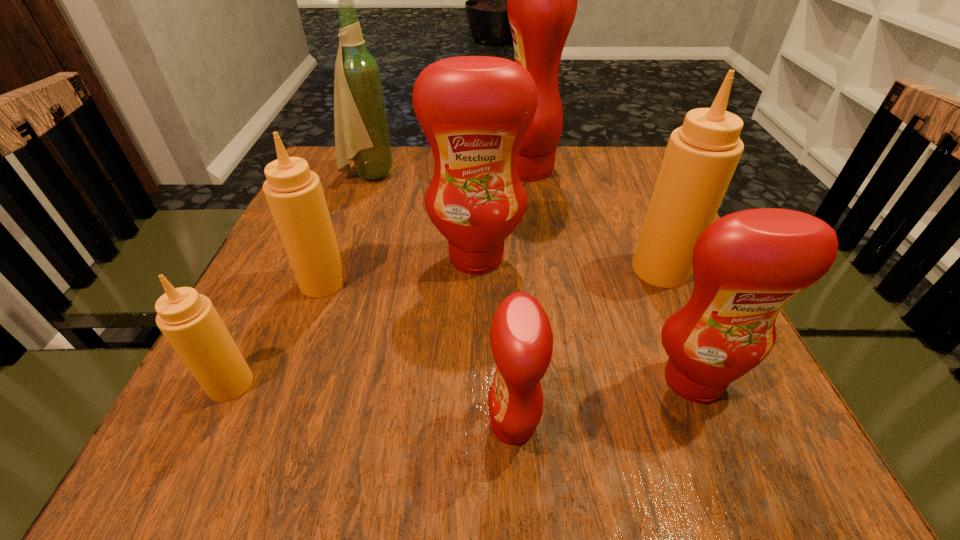
The height and width of the screenshot is (540, 960). What are the coordinates of `vacant space located 0.060m on the label side of the smallest red condiment` in the screenshot? It's located at click(x=445, y=424).

Image resolution: width=960 pixels, height=540 pixels. I want to click on vacant space located on the label side of the smallest red condiment, so click(x=389, y=424).

Locate an element on the screen. free space located on the right of the leftmost tan condiment is located at coordinates (x=514, y=384).

Identify the location of condiment that is at the far edge. This screenshot has width=960, height=540. (542, 0).

Find the location of a particular element. The width and height of the screenshot is (960, 540). wine bottle that is at the far edge is located at coordinates (362, 136).

This screenshot has width=960, height=540. What are the coordinates of `object present at the near edge` in the screenshot? It's located at (521, 338).

Find the location of a particular element. The width and height of the screenshot is (960, 540). wine bottle present at the left edge is located at coordinates (362, 136).

The image size is (960, 540). Find the location of `object that is at the far left corner`. object that is at the far left corner is located at coordinates (362, 136).

The height and width of the screenshot is (540, 960). Find the location of `free location at the far edge`. free location at the far edge is located at coordinates (574, 188).

The height and width of the screenshot is (540, 960). In the image, there is a desktop. What are the coordinates of `vacant space at the near edge` in the screenshot? It's located at (496, 471).